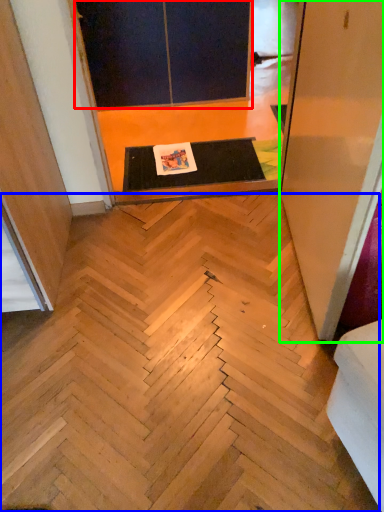
Question: Considering the real-world distances, which object is farthest from screen door (highlighted by a red box)? stairwell (highlighted by a blue box) or screen door (highlighted by a green box)?

Choices:
 (A) stairwell
 (B) screen door

Answer: (A)